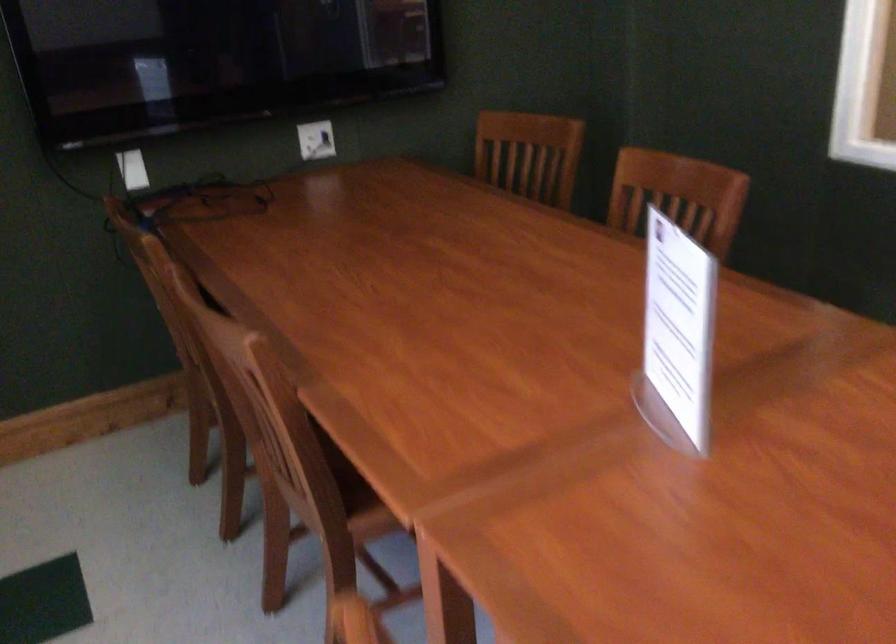
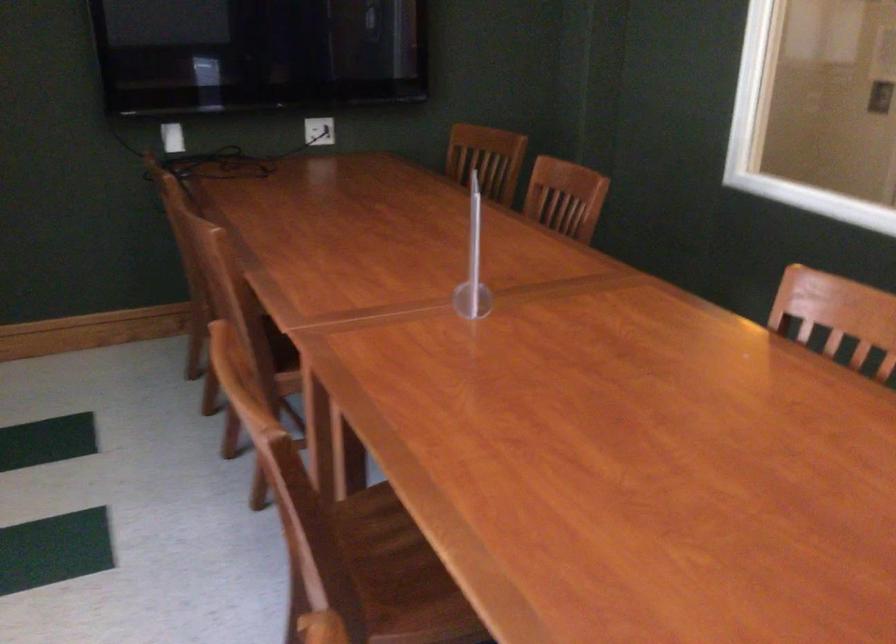
The point at (613, 327) is marked in the first image. Where is the corresponding point in the second image?

(472, 263)